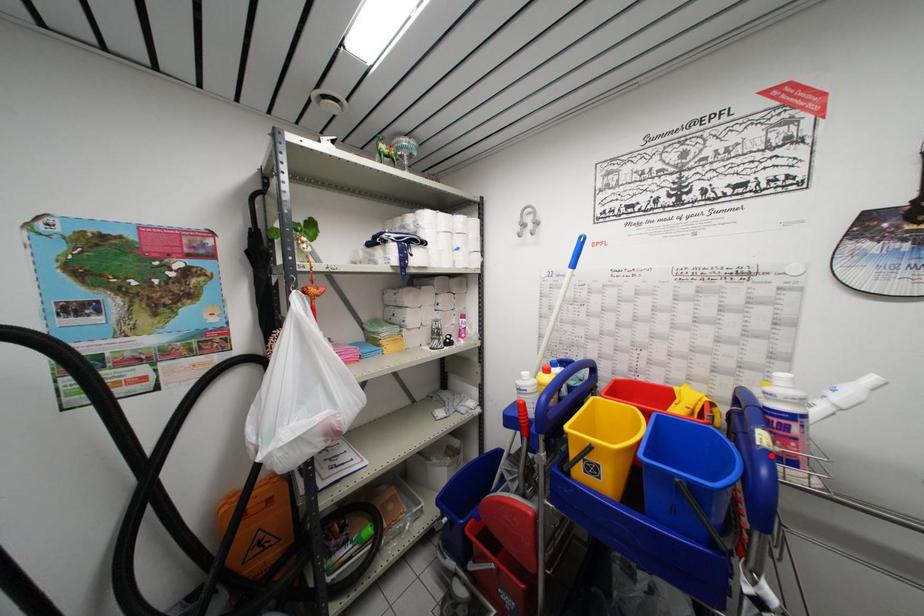
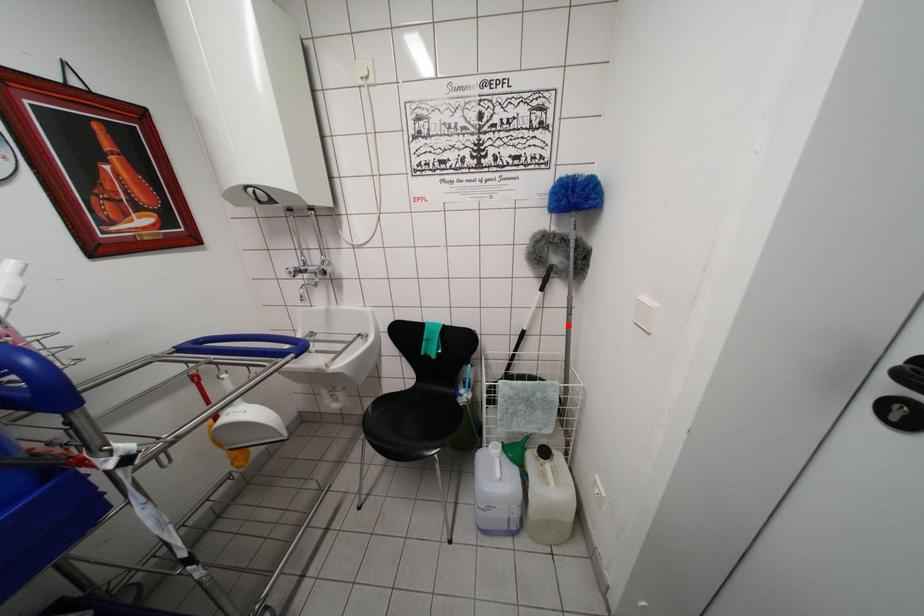
I am providing you with two images of the same scene from different viewpoints. A red point is marked on the first image and another point is marked on the second image. Is the marked point in image1 the same physical position as the marked point in image2?

No